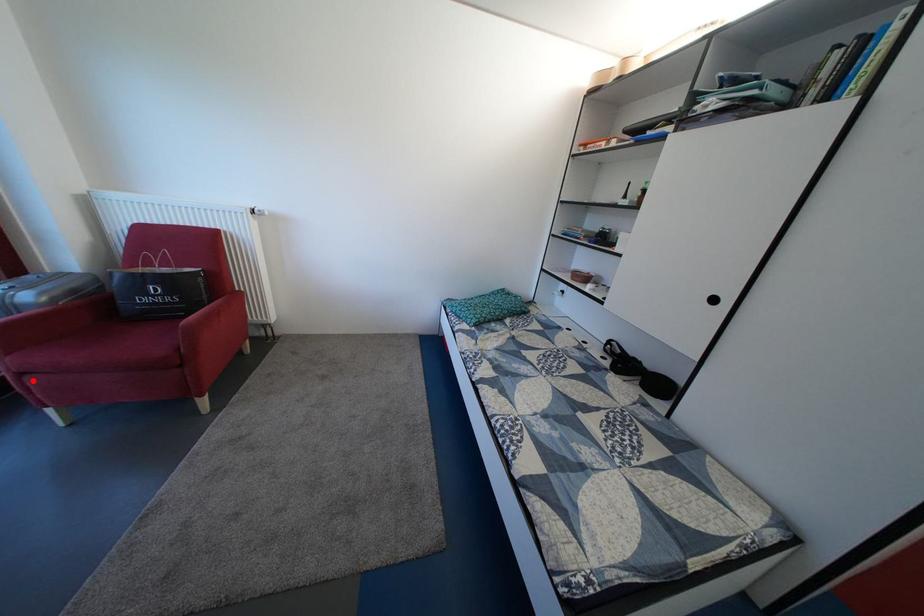
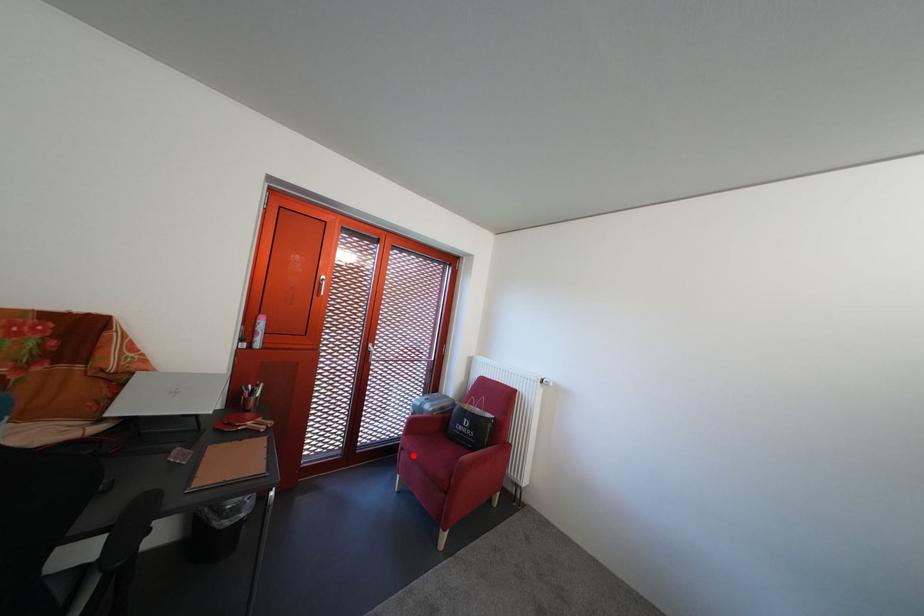
I am providing you with two images of the same scene from different viewpoints. A red point is marked on the first image and another point is marked on the second image. Is the red point in image1 aligned with the point shown in image2?

Yes